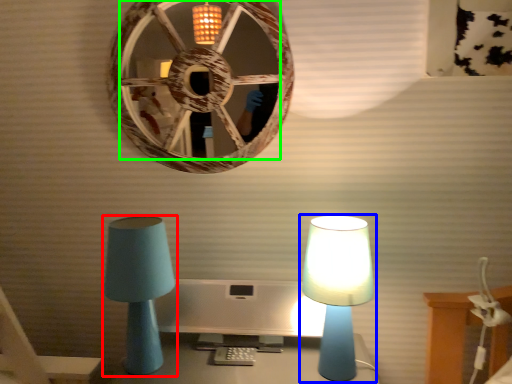
Question: Estimate the real-world distances between objects in this image. Which object is closer to lamp (highlighted by a red box), lamp (highlighted by a blue box) or mirror (highlighted by a green box)?

Choices:
 (A) lamp
 (B) mirror

Answer: (A)